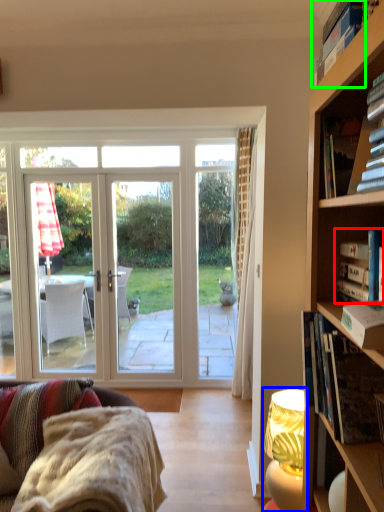
Question: Which object is the farthest from book (highlighted by a red box)? Choose among these: lamp (highlighted by a blue box) or book (highlighted by a green box).

Choices:
 (A) lamp
 (B) book

Answer: (A)